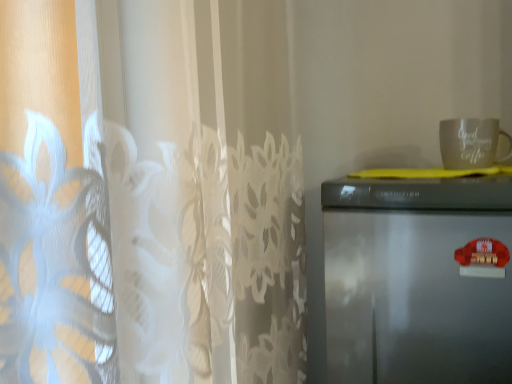
Question: Is satin silver refrigerator at right far away from matte white mug at upper right?

Choices:
 (A) no
 (B) yes

Answer: (A)

Question: From a real-world perspective, is satin silver refrigerator at right beneath matte white mug at upper right?

Choices:
 (A) no
 (B) yes

Answer: (B)

Question: Considering the relative positions of satin silver refrigerator at right and matte white mug at upper right in the image provided, is satin silver refrigerator at right behind matte white mug at upper right?

Choices:
 (A) yes
 (B) no

Answer: (B)

Question: Considering the relative positions of satin silver refrigerator at right and matte white mug at upper right in the image provided, is satin silver refrigerator at right to the right of matte white mug at upper right from the viewer's perspective?

Choices:
 (A) no
 (B) yes

Answer: (A)

Question: Considering the relative sizes of satin silver refrigerator at right and matte white mug at upper right in the image provided, is satin silver refrigerator at right bigger than matte white mug at upper right?

Choices:
 (A) no
 (B) yes

Answer: (B)

Question: Is satin silver refrigerator at right in front of matte white mug at upper right?

Choices:
 (A) no
 (B) yes

Answer: (B)

Question: From a real-world perspective, is matte white mug at upper right below satin silver refrigerator at right?

Choices:
 (A) yes
 (B) no

Answer: (B)

Question: Is matte white mug at upper right facing towards satin silver refrigerator at right?

Choices:
 (A) no
 (B) yes

Answer: (A)

Question: Does matte white mug at upper right appear on the right side of satin silver refrigerator at right?

Choices:
 (A) yes
 (B) no

Answer: (A)

Question: Does matte white mug at upper right have a smaller size compared to satin silver refrigerator at right?

Choices:
 (A) yes
 (B) no

Answer: (A)

Question: Is satin silver refrigerator at right inside matte white mug at upper right?

Choices:
 (A) yes
 (B) no

Answer: (B)

Question: Does matte white mug at upper right come behind satin silver refrigerator at right?

Choices:
 (A) yes
 (B) no

Answer: (A)

Question: Visually, is satin silver refrigerator at right positioned to the left or to the right of matte white mug at upper right?

Choices:
 (A) left
 (B) right

Answer: (A)